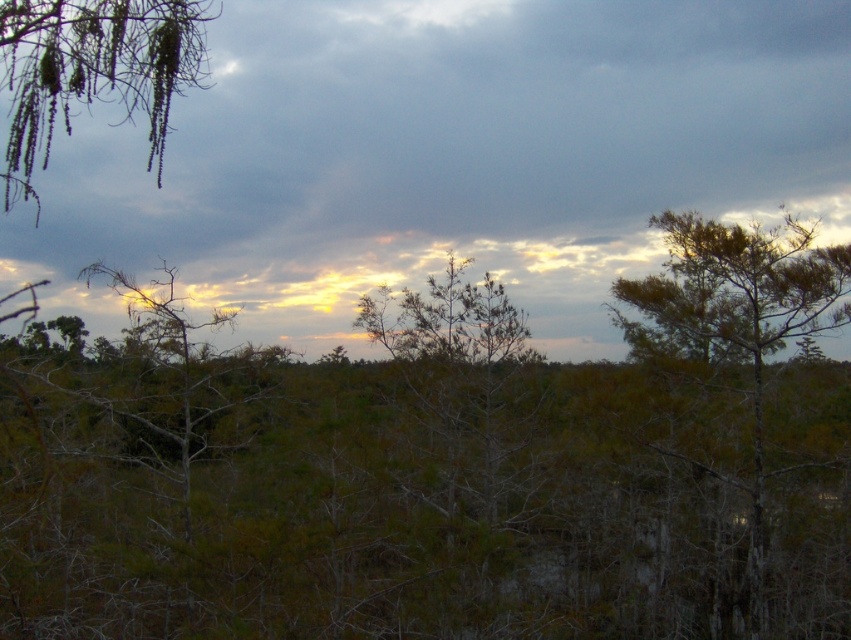
You are standing in the middle of a forest and see the green matte tree at center and the green matte hanging branches at upper left. Which object is located to the right side from your perspective?

The green matte tree at center is located to the right of the green matte hanging branches at upper left.

You are standing in the landscape scene and want to walk from point A to point B. Point A is located at coordinates point [707,252], and point B is at point [147,52]. Considering the spatial relationship between these two points, which direction should you head to reach point B from point A?

To reach point B from point A, you should head downward and to the left because point [147,52] is positioned lower and to the left of point [707,252] in the image.